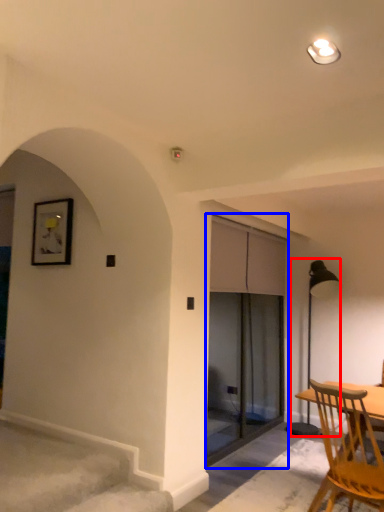
Question: Which object is closer to the camera taking this photo, lamp (highlighted by a red box) or screen door (highlighted by a blue box)?

Choices:
 (A) lamp
 (B) screen door

Answer: (B)